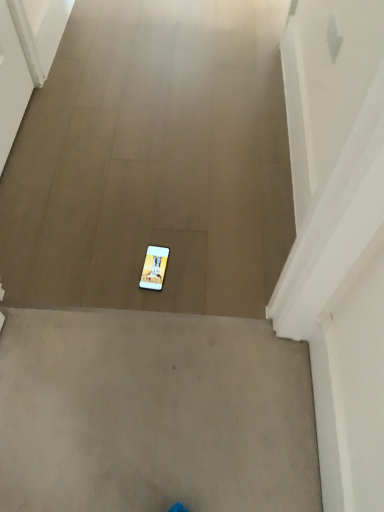
I want to click on free space to the left of white glossy mobile phone at center, so click(104, 268).